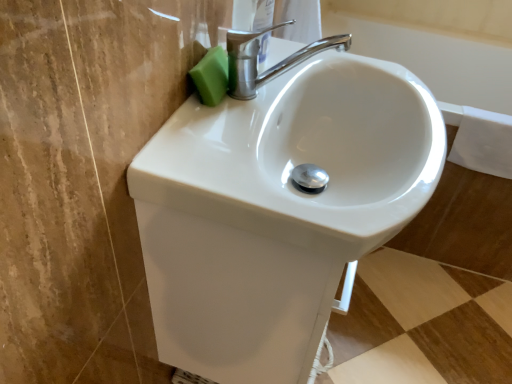
Question: From a real-world perspective, is green sponge at upper left located beneath polished chrome faucet at upper center?

Choices:
 (A) no
 (B) yes

Answer: (A)

Question: Is green sponge at upper left outside of polished chrome faucet at upper center?

Choices:
 (A) yes
 (B) no

Answer: (A)

Question: Does green sponge at upper left contain polished chrome faucet at upper center?

Choices:
 (A) yes
 (B) no

Answer: (B)

Question: Considering the relative sizes of green sponge at upper left and polished chrome faucet at upper center in the image provided, is green sponge at upper left thinner than polished chrome faucet at upper center?

Choices:
 (A) yes
 (B) no

Answer: (A)

Question: Is green sponge at upper left touching polished chrome faucet at upper center?

Choices:
 (A) no
 (B) yes

Answer: (A)

Question: From a real-world perspective, is polished chrome faucet at upper center positioned above or below white glossy sink at center?

Choices:
 (A) below
 (B) above

Answer: (B)

Question: Visually, is polished chrome faucet at upper center positioned to the left or to the right of white glossy sink at center?

Choices:
 (A) left
 (B) right

Answer: (B)

Question: Is point (249, 61) positioned closer to the camera than point (306, 354)?

Choices:
 (A) closer
 (B) farther

Answer: (A)

Question: Considering the positions of polished chrome faucet at upper center and white glossy sink at center in the image, is polished chrome faucet at upper center wider or thinner than white glossy sink at center?

Choices:
 (A) thin
 (B) wide

Answer: (A)

Question: Is white glossy sink at center inside the boundaries of polished chrome faucet at upper center, or outside?

Choices:
 (A) outside
 (B) inside

Answer: (A)

Question: Is white glossy sink at center taller or shorter than polished chrome faucet at upper center?

Choices:
 (A) tall
 (B) short

Answer: (B)

Question: Considering the positions of point (323, 244) and point (327, 39), is point (323, 244) closer or farther from the camera than point (327, 39)?

Choices:
 (A) farther
 (B) closer

Answer: (B)

Question: Is white glossy sink at center wider or thinner than polished chrome faucet at upper center?

Choices:
 (A) wide
 (B) thin

Answer: (A)

Question: Would you say green sponge at upper left is inside or outside white glossy sink at center?

Choices:
 (A) outside
 (B) inside

Answer: (A)

Question: From the image's perspective, is green sponge at upper left above or below white glossy sink at center?

Choices:
 (A) below
 (B) above

Answer: (B)